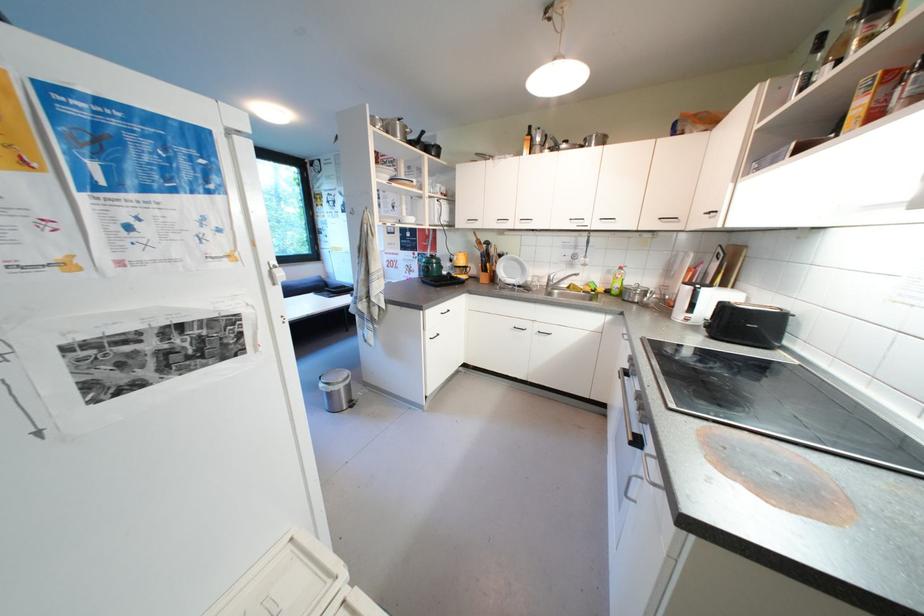
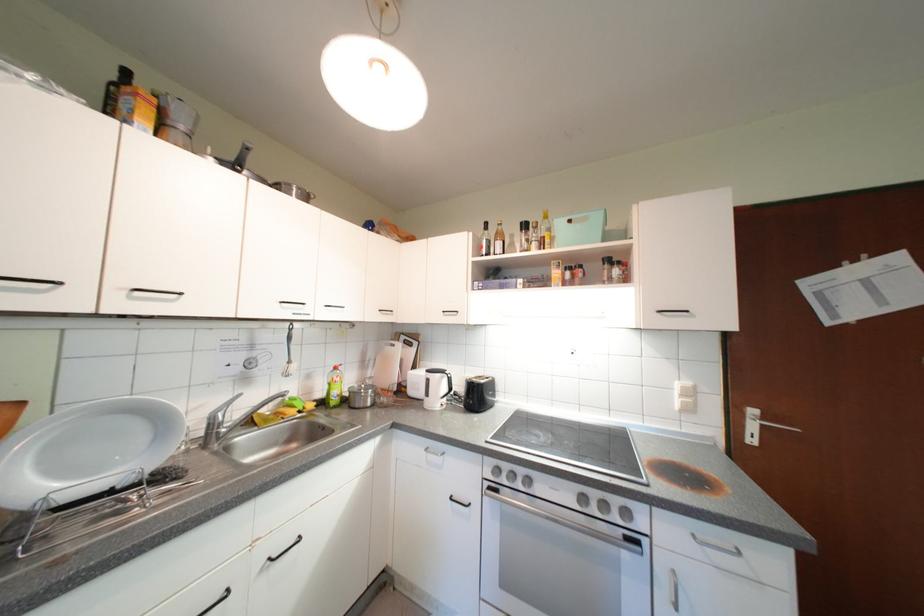
Find the pixel in the second image that matches (600,138) in the first image.

(298, 187)